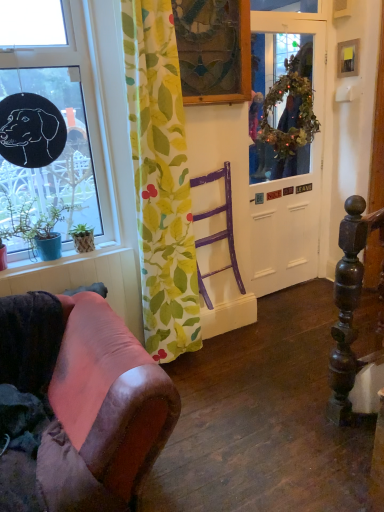
Question: Considering the positions of green leafy fabric curtain at center and smooth wood window sill at lower left in the image, is green leafy fabric curtain at center taller or shorter than smooth wood window sill at lower left?

Choices:
 (A) tall
 (B) short

Answer: (A)

Question: Looking at their shapes, would you say green leafy fabric curtain at center is wider or thinner than smooth wood window sill at lower left?

Choices:
 (A) wide
 (B) thin

Answer: (A)

Question: Estimate the real-world distances between objects in this image. Which object is farther from the green leafy plant at left, marked as the 1th houseplant in a left-to-right arrangement?

Choices:
 (A) smooth wood window sill at lower left
 (B) wooden picture frame at upper right, the second picture frame when ordered from front to back
 (C) green leafy wreath at upper right
 (D) black matte window at upper left
 (E) stained glass picture frame at upper center, arranged as the 2th picture frame when viewed from the right

Answer: (B)

Question: Which is nearer to the purple painted wood chair at center?

Choices:
 (A) smooth wood window sill at lower left
 (B) green leafy wreath at upper right
 (C) white matte door at center
 (D) stained glass picture frame at upper center, arranged as the 2th picture frame when viewed from the right
 (E) wooden picture frame at upper right, positioned as the 2th picture frame in left-to-right order

Answer: (D)